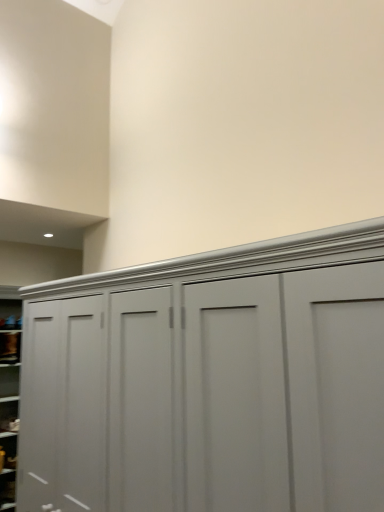
Question: Is the depth of matte gray cabinet at lower left, which ranks as the 1th cabinet in bottom-to-top order, less than that of matte gray cupboard at center?

Choices:
 (A) no
 (B) yes

Answer: (A)

Question: Does matte gray cabinet at lower left, which ranks as the 1th cabinet in bottom-to-top order, turn towards matte gray cupboard at center?

Choices:
 (A) no
 (B) yes

Answer: (A)

Question: From a real-world perspective, is matte gray cabinet at lower left, which ranks as the 1th cabinet in bottom-to-top order, under matte gray cupboard at center?

Choices:
 (A) yes
 (B) no

Answer: (A)

Question: Can you confirm if matte gray cabinet at lower left, the second cabinet when ordered from top to bottom, is wider than matte gray cupboard at center?

Choices:
 (A) no
 (B) yes

Answer: (A)

Question: Is matte gray cabinet at lower left, which ranks as the 1th cabinet in bottom-to-top order, bigger than matte gray cupboard at center?

Choices:
 (A) yes
 (B) no

Answer: (B)

Question: Does matte gray cabinet at lower left, the second cabinet when ordered from top to bottom, have a lesser width compared to matte gray cupboard at center?

Choices:
 (A) yes
 (B) no

Answer: (A)

Question: Is matte gray cupboard at center facing towards matte gray cabinet at lower left, the second cabinet when ordered from top to bottom?

Choices:
 (A) yes
 (B) no

Answer: (B)

Question: Is matte gray cupboard at center taller than matte gray cabinet at lower left, the second cabinet when ordered from top to bottom?

Choices:
 (A) no
 (B) yes

Answer: (B)

Question: Can you confirm if matte gray cupboard at center is wider than matte gray cabinet at lower left, the second cabinet when ordered from top to bottom?

Choices:
 (A) no
 (B) yes

Answer: (B)

Question: Does matte gray cupboard at center appear on the left side of matte gray cabinet at lower left, which ranks as the 1th cabinet in bottom-to-top order?

Choices:
 (A) no
 (B) yes

Answer: (A)

Question: Can you confirm if matte gray cupboard at center is smaller than matte gray cabinet at lower left, the second cabinet when ordered from top to bottom?

Choices:
 (A) no
 (B) yes

Answer: (A)

Question: Does matte gray cupboard at center have a lesser width compared to matte gray cabinet at lower left, the second cabinet when ordered from top to bottom?

Choices:
 (A) no
 (B) yes

Answer: (A)

Question: Does matte gray cupboard at center contain matte gray cabinet at lower left, the first cabinet when ordered from top to bottom?

Choices:
 (A) no
 (B) yes

Answer: (A)